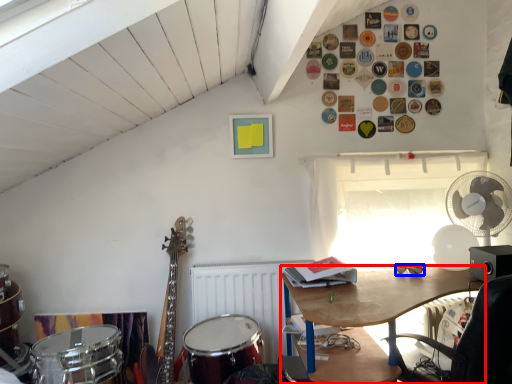
Question: Which of the following is the closest to the observer, desk (highlighted by a red box) or glasses (highlighted by a blue box)?

Choices:
 (A) desk
 (B) glasses

Answer: (A)